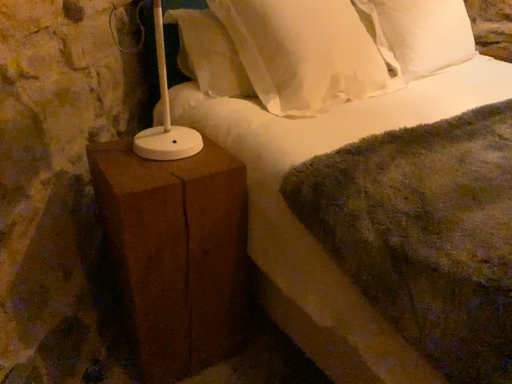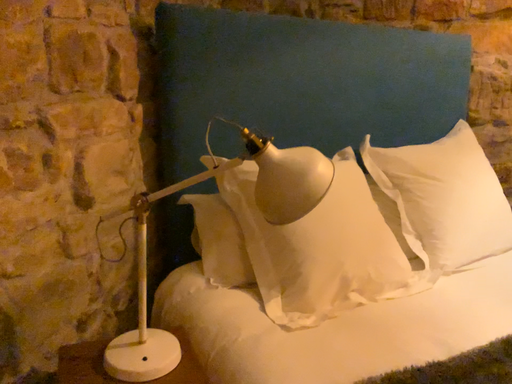
Question: Which way did the camera rotate in the video?

Choices:
 (A) rotated right
 (B) rotated left

Answer: (B)